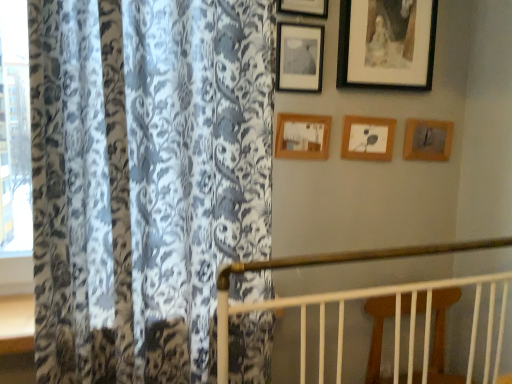
Question: Is wooden picture frame at upper center, the fifth picture frame when ordered from right to left, taller or shorter than floral-patterned fabric at left?

Choices:
 (A) tall
 (B) short

Answer: (B)

Question: Considering the relative positions of wooden picture frame at upper center, the fifth picture frame when ordered from right to left, and floral-patterned fabric at left in the image provided, is wooden picture frame at upper center, the fifth picture frame when ordered from right to left, to the left or to the right of floral-patterned fabric at left?

Choices:
 (A) left
 (B) right

Answer: (B)

Question: Which of these objects is positioned farthest from the wooden picture frame at upper center, the fifth picture frame when ordered from right to left?

Choices:
 (A) black matte picture frame at upper right, positioned as the second picture frame in right-to-left order
 (B) wooden picture frame at upper right, marked as the 6th picture frame in a left-to-right arrangement
 (C) floral-patterned fabric at left
 (D) wooden picture frame at center, marked as the fourth picture frame in a right-to-left arrangement
 (E) wooden picture frame at upper center, the 4th picture frame when ordered from left to right

Answer: (C)

Question: Considering the real-world distances, which object is closest to the wooden picture frame at upper center, which is the second picture frame from left to right?

Choices:
 (A) floral-patterned fabric at left
 (B) matte black picture frame at upper center, which appears as the 6th picture frame when viewed from the right
 (C) wooden picture frame at upper right, marked as the 6th picture frame in a left-to-right arrangement
 (D) wooden picture frame at center, marked as the fourth picture frame in a right-to-left arrangement
 (E) wooden picture frame at upper center, positioned as the 3th picture frame in right-to-left order

Answer: (B)